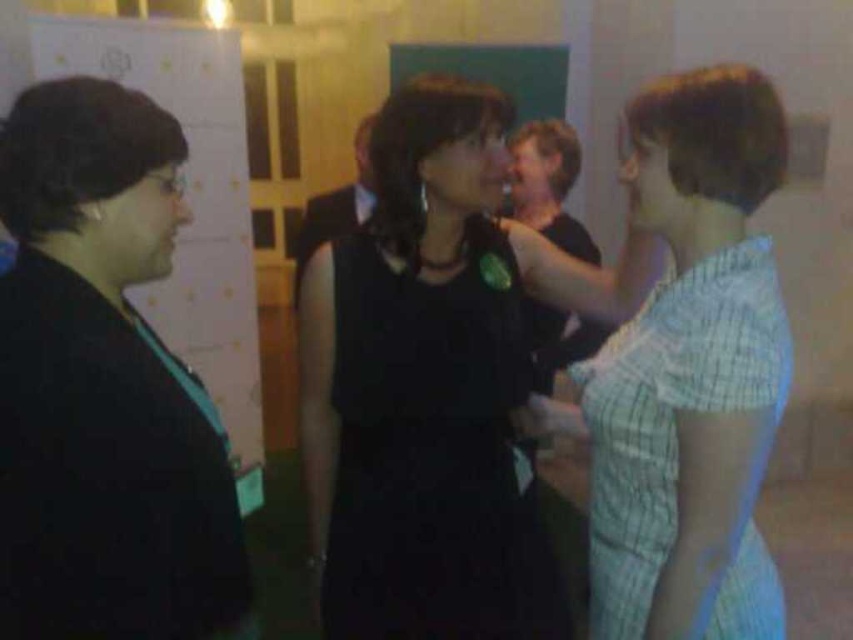
Question: Does black matte jacket at left appear on the right side of black matte dress at center?

Choices:
 (A) no
 (B) yes

Answer: (A)

Question: Where is black matte dress at center located in relation to light blue checkered dress at right in the image?

Choices:
 (A) above
 (B) below

Answer: (B)

Question: Estimate the real-world distances between objects in this image. Which object is farther from the light blue checkered dress at right?

Choices:
 (A) black matte jacket at left
 (B) black matte dress at center

Answer: (A)

Question: Which point is farther from the camera taking this photo?

Choices:
 (A) (741, 536)
 (B) (44, 353)

Answer: (A)

Question: Is black matte jacket at left positioned in front of light blue checkered dress at right?

Choices:
 (A) no
 (B) yes

Answer: (B)

Question: Which point is closer to the camera taking this photo?

Choices:
 (A) (349, 531)
 (B) (122, 588)
 (C) (636, 621)

Answer: (B)